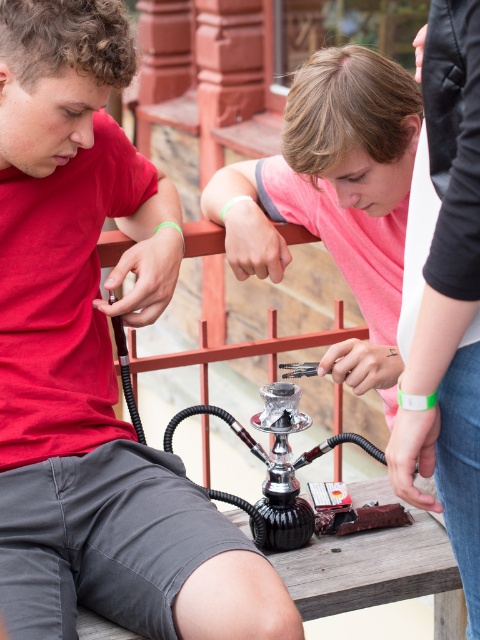
Question: Considering the real-world distances, which object is closest to the metallic shisha at center?

Choices:
 (A) shiny metallic hookah at center
 (B) matte black hookah at center

Answer: (B)

Question: From the image, what is the correct spatial relationship of metallic shisha at center in relation to shiny metallic hookah at center?

Choices:
 (A) right
 (B) left

Answer: (A)

Question: Does matte black hookah at center have a greater width compared to metallic shisha at center?

Choices:
 (A) no
 (B) yes

Answer: (B)

Question: Which object is closer to the camera taking this photo?

Choices:
 (A) matte black hookah at center
 (B) metallic shisha at center

Answer: (A)

Question: Does metallic shisha at center have a greater width compared to shiny metallic hookah at center?

Choices:
 (A) yes
 (B) no

Answer: (B)

Question: Considering the real-world distances, which object is farthest from the shiny metallic hookah at center?

Choices:
 (A) matte black hookah at center
 (B) metallic shisha at center

Answer: (B)